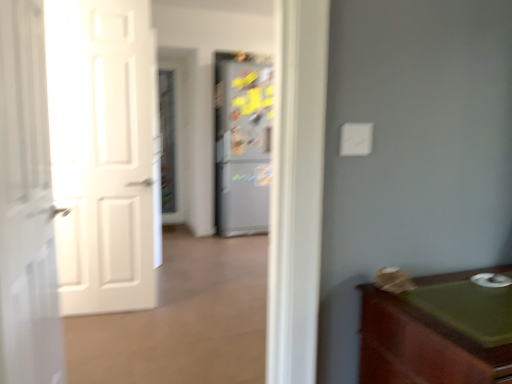
Question: Is white glossy door at left, the 1th door viewed from the front, wider or thinner than green wood cabinet at lower right?

Choices:
 (A) thin
 (B) wide

Answer: (A)

Question: Is white glossy door at left, positioned as the second door in back-to-front order, in front of or behind green wood cabinet at lower right in the image?

Choices:
 (A) front
 (B) behind

Answer: (B)

Question: Which object is positioned closest to the metallic gray refrigerator at center?

Choices:
 (A) green wood cabinet at lower right
 (B) clear glass screen door at center
 (C) white glossy door at left, positioned as the second door in back-to-front order
 (D) white matte door at left, arranged as the 2th door when viewed from the front

Answer: (B)

Question: Which is farther from the clear glass screen door at center?

Choices:
 (A) metallic gray refrigerator at center
 (B) white matte door at left, the first door in the back-to-front sequence
 (C) white glossy door at left, the 1th door viewed from the front
 (D) green wood cabinet at lower right

Answer: (D)